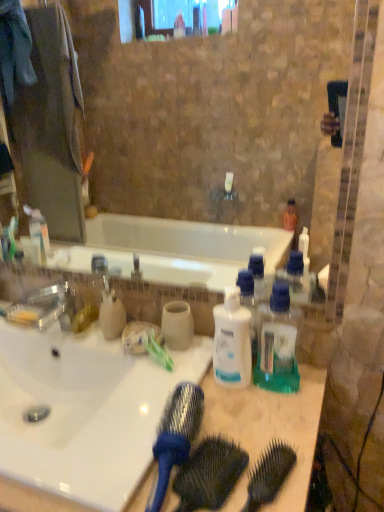
Locate an element on the screen. blank area to the left of translucent green plastic at center, the 1th bottle positioned from the right is located at coordinates (209, 393).